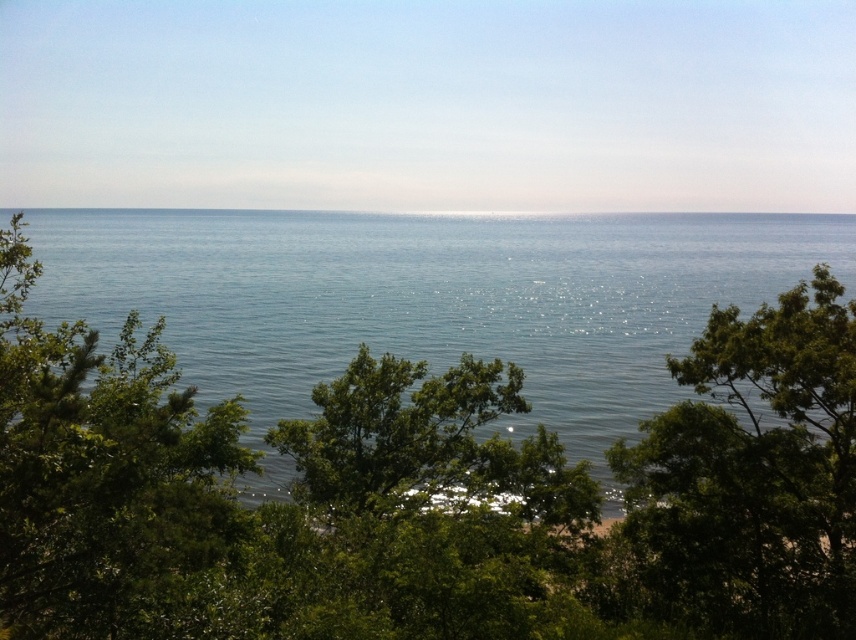
Question: Considering the relative positions of clear blue water at center and green leafy tree at center in the image provided, where is clear blue water at center located with respect to green leafy tree at center?

Choices:
 (A) right
 (B) left

Answer: (B)

Question: From the image, what is the correct spatial relationship of green leafy tree at left in relation to green leafy tree at center?

Choices:
 (A) below
 (B) above

Answer: (B)

Question: Which point is farther from the camera taking this photo?

Choices:
 (A) (248, 532)
 (B) (831, 481)
 (C) (479, 262)

Answer: (C)

Question: Which object is closer to the camera taking this photo?

Choices:
 (A) green leafy tree at left
 (B) clear blue water at center
 (C) green leafy tree at center

Answer: (A)

Question: Does clear blue water at center have a larger size compared to green leafy tree at center?

Choices:
 (A) no
 (B) yes

Answer: (B)

Question: Which of the following is the farthest from the observer?

Choices:
 (A) (137, 461)
 (B) (518, 348)

Answer: (B)